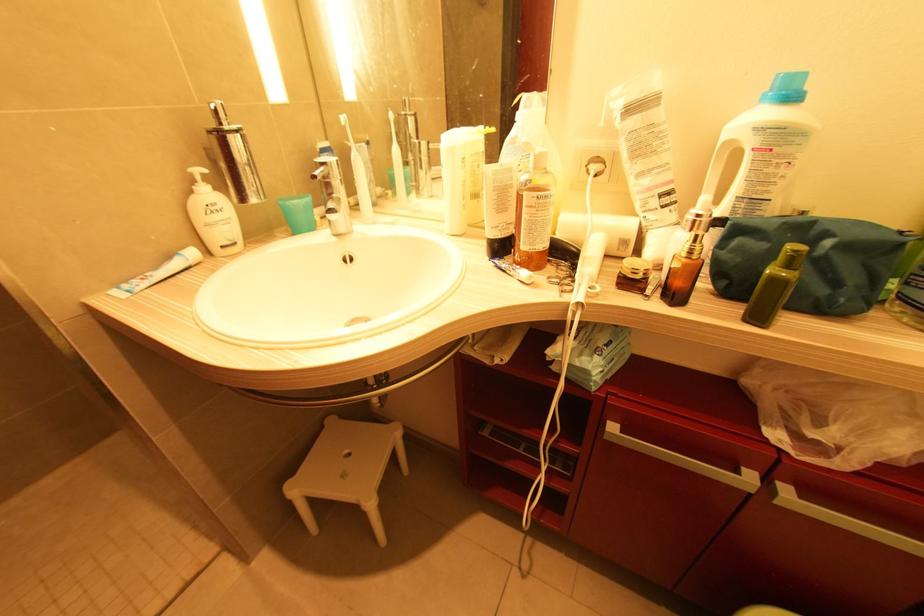
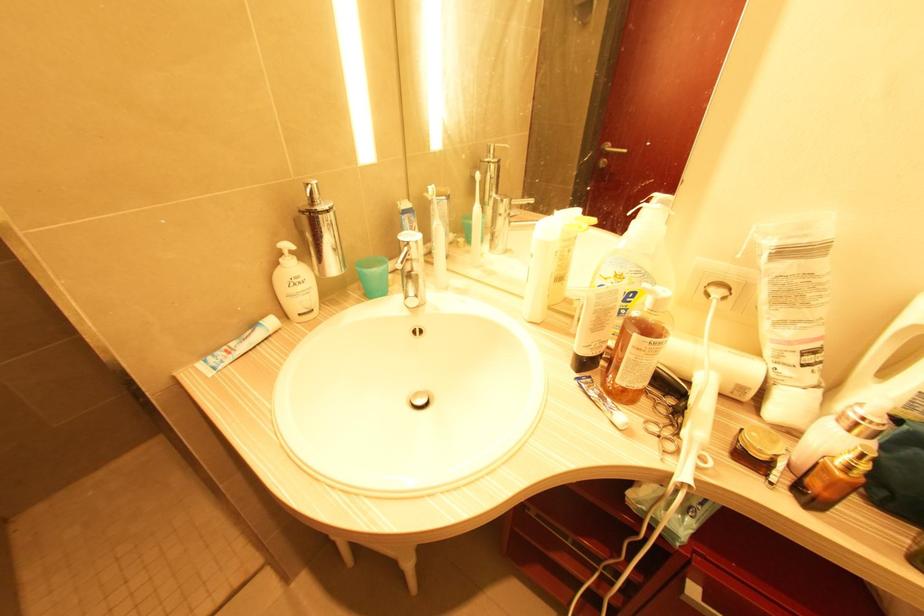
The point at (192, 192) is marked in the first image. Where is the corresponding point in the second image?

(280, 265)